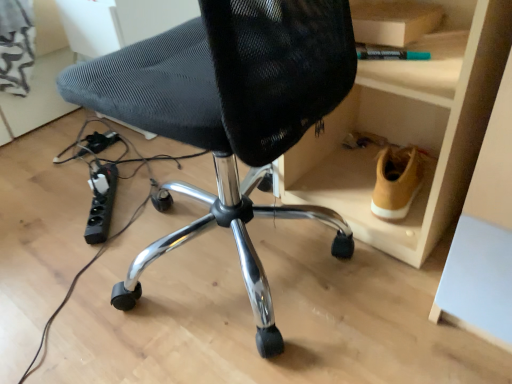
Question: Does black mesh chair at center come behind black plastic plug at lower left, which is the 2th plug in right-to-left order?

Choices:
 (A) yes
 (B) no

Answer: (B)

Question: From a real-world perspective, is black mesh chair at center positioned over black plastic plug at lower left, placed as the first plug when sorted from left to right, based on gravity?

Choices:
 (A) yes
 (B) no

Answer: (A)

Question: Is black mesh chair at center positioned with its back to black plastic plug at lower left, which is the 2th plug in right-to-left order?

Choices:
 (A) yes
 (B) no

Answer: (B)

Question: Can you confirm if black mesh chair at center is taller than black plastic plug at lower left, acting as the 2th plug starting from the bottom?

Choices:
 (A) no
 (B) yes

Answer: (B)

Question: From the image's perspective, does black mesh chair at center appear higher than black plastic plug at lower left, which is the 2th plug in right-to-left order?

Choices:
 (A) yes
 (B) no

Answer: (B)

Question: Based on their sizes in the image, would you say tan suede shoe at lower right is bigger or smaller than black mesh chair at center?

Choices:
 (A) small
 (B) big

Answer: (A)

Question: Is tan suede shoe at lower right spatially inside black mesh chair at center, or outside of it?

Choices:
 (A) inside
 (B) outside

Answer: (B)

Question: Considering the positions of tan suede shoe at lower right and black mesh chair at center in the image, is tan suede shoe at lower right wider or thinner than black mesh chair at center?

Choices:
 (A) thin
 (B) wide

Answer: (A)

Question: Based on their positions, is tan suede shoe at lower right located to the left or right of black mesh chair at center?

Choices:
 (A) right
 (B) left

Answer: (A)

Question: From a real-world perspective, is black plastic plug at lower left, which is the 2th plug in right-to-left order, above or below black mesh chair at center?

Choices:
 (A) above
 (B) below

Answer: (B)

Question: In the image, is black plastic plug at lower left, positioned as the second plug in front-to-back order, on the left side or the right side of black mesh chair at center?

Choices:
 (A) left
 (B) right

Answer: (A)

Question: Would you say black plastic plug at lower left, acting as the 2th plug starting from the bottom, is inside or outside black mesh chair at center?

Choices:
 (A) outside
 (B) inside

Answer: (A)

Question: Is black plastic plug at lower left, placed as the first plug when sorted from left to right, bigger or smaller than black mesh chair at center?

Choices:
 (A) small
 (B) big

Answer: (A)

Question: Considering the positions of black mesh chair at center and black plastic power strip at lower left, which ranks as the 2th plug in top-to-bottom order, in the image, is black mesh chair at center wider or thinner than black plastic power strip at lower left, which ranks as the 2th plug in top-to-bottom order,?

Choices:
 (A) thin
 (B) wide

Answer: (B)

Question: From the image's perspective, is black mesh chair at center above or below black plastic power strip at lower left, the first plug viewed from the front?

Choices:
 (A) below
 (B) above

Answer: (B)